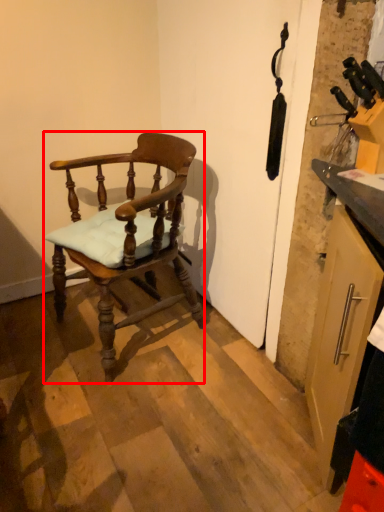
Question: Where is chair (annotated by the red box) located in relation to cabinetry in the image?

Choices:
 (A) right
 (B) left

Answer: (B)